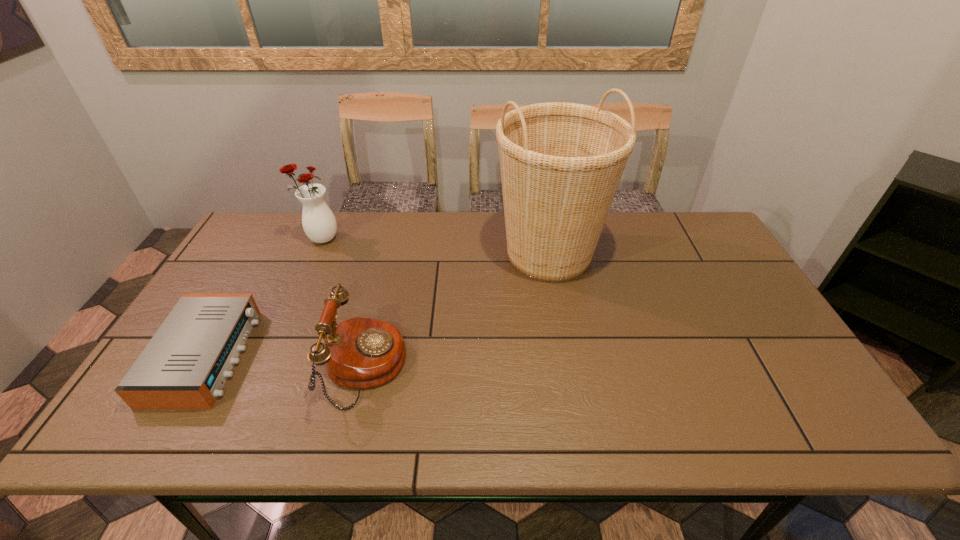
This screenshot has height=540, width=960. Find the location of `vacant space that's between the basket and the second shortest object`. vacant space that's between the basket and the second shortest object is located at coordinates 457,310.

This screenshot has height=540, width=960. I want to click on vacant point located between the second tallest object and the basket, so click(435, 246).

Where is `unoccupied area between the vase and the tallest object`? unoccupied area between the vase and the tallest object is located at coordinates (435, 246).

Image resolution: width=960 pixels, height=540 pixels. I want to click on free space between the tallest object and the third tallest object, so click(457, 310).

Locate an element on the screen. unoccupied position between the rightmost object and the radio receiver is located at coordinates (377, 305).

You are a GUI agent. You are given a task and a screenshot of the screen. Output one action in this format:
    pyautogui.click(x=<x>, y=<y>)
    Task: Click on the free space between the vase and the tallest object
    The image size is (960, 540).
    Given the screenshot: What is the action you would take?
    pyautogui.click(x=435, y=246)

Where is `free space that is in between the basket and the third tallest object`? free space that is in between the basket and the third tallest object is located at coordinates (457, 310).

Select which object is the closest to the vase. Please provide its 2D coordinates. Your answer should be formatted as a tuple, i.e. [(x, y)], where the tuple contains the x and y coordinates of a point satisfying the conditions above.

[(185, 365)]

Image resolution: width=960 pixels, height=540 pixels. I want to click on object that is the third closest to the vase, so click(x=561, y=163).

At what (x,y) coordinates should I click in order to perform the action: click on free spot that satisfies the following two spatial constraints: 1. on the front side of the rightmost object; 2. on the right side of the second tallest object. Please return your answer as a coordinate pair (x, y). Looking at the image, I should click on (314, 254).